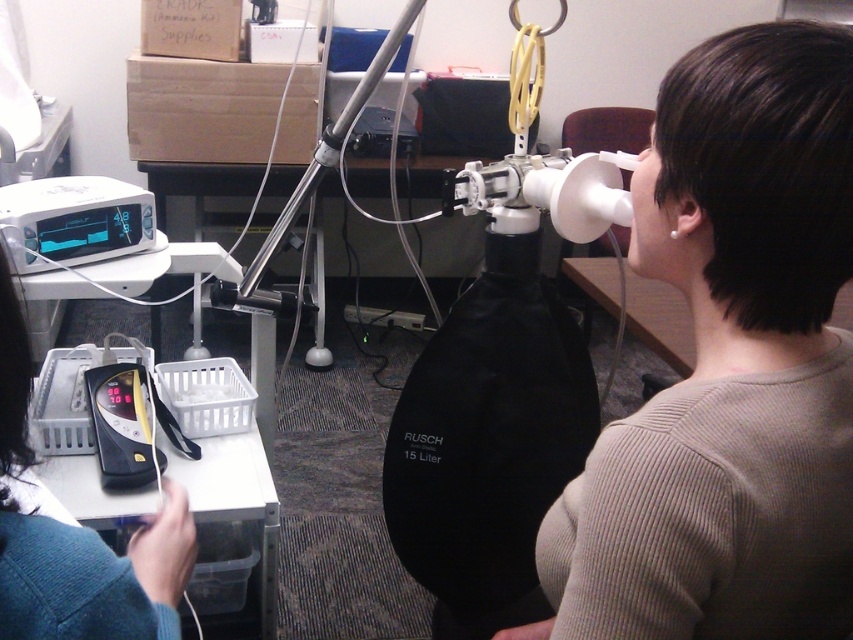
You are a technician in a lab and need to place a small medical tool on the table near the teal knit sweater at lower left. Given that the table is 1 meter wide and the point marking the teal knit sweater at lower left is at coordinate (91, 573), can you determine if the tool will fit on the table if it requires 0.2 meters of space?

The point marking the teal knit sweater at lower left is at coordinate (91, 573). Since the table is 1 meter wide, the tool requiring 0.2 meters of space will fit as there is sufficient space remaining on the table.

You are a healthcare professional preparing to set up equipment for a patient. You have a teal knit sweater at lower left and a silver metallic tripod at center. Which item should you move first to ensure there is enough space for the spirometer bag?

The teal knit sweater at lower left should be moved first because it is smaller than the silver metallic tripod at center, making it easier to relocate to free up space.